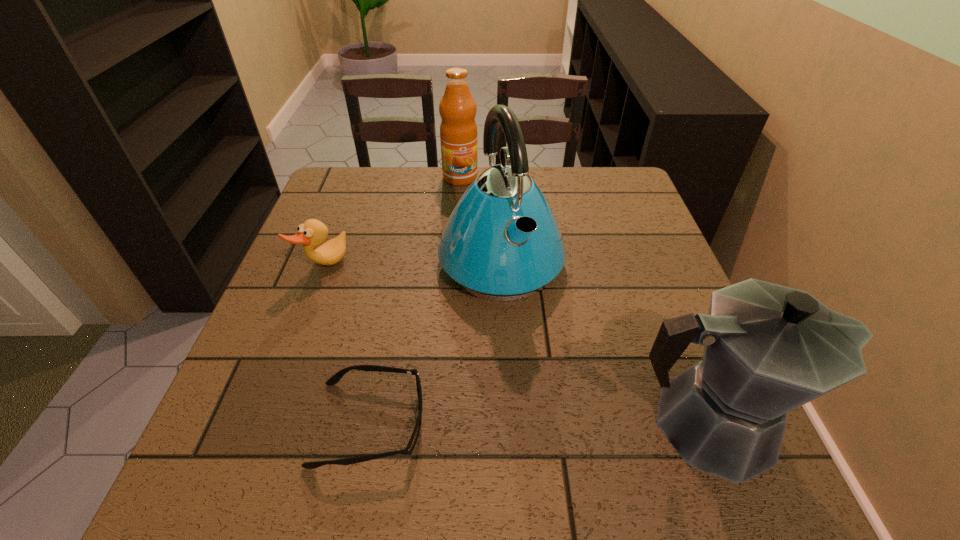
Identify the location of object at the right edge. click(x=768, y=349).

In order to click on object situated at the near right corner in this screenshot , I will do `click(768, 349)`.

Image resolution: width=960 pixels, height=540 pixels. Find the location of `free space at the far edge`. free space at the far edge is located at coordinates (573, 175).

The height and width of the screenshot is (540, 960). I want to click on vacant space at the near edge of the desktop, so click(x=644, y=433).

This screenshot has width=960, height=540. Identify the location of vacant space at the left edge of the desktop. (359, 250).

In order to click on free space at the right edge of the desktop in this screenshot , I will do `click(666, 259)`.

Locate an element on the screen. The image size is (960, 540). free space at the far right corner of the desktop is located at coordinates (582, 178).

Where is `free space between the kettle and the shortest object`? This screenshot has height=540, width=960. free space between the kettle and the shortest object is located at coordinates (435, 342).

The image size is (960, 540). Identify the location of vacant area that lies between the tallest object and the rightmost object. (603, 342).

At what (x,y) coordinates should I click in order to perform the action: click on unoccupied area between the coffeepot and the tallest object. Please return your answer as a coordinate pair (x, y). Looking at the image, I should click on (603, 342).